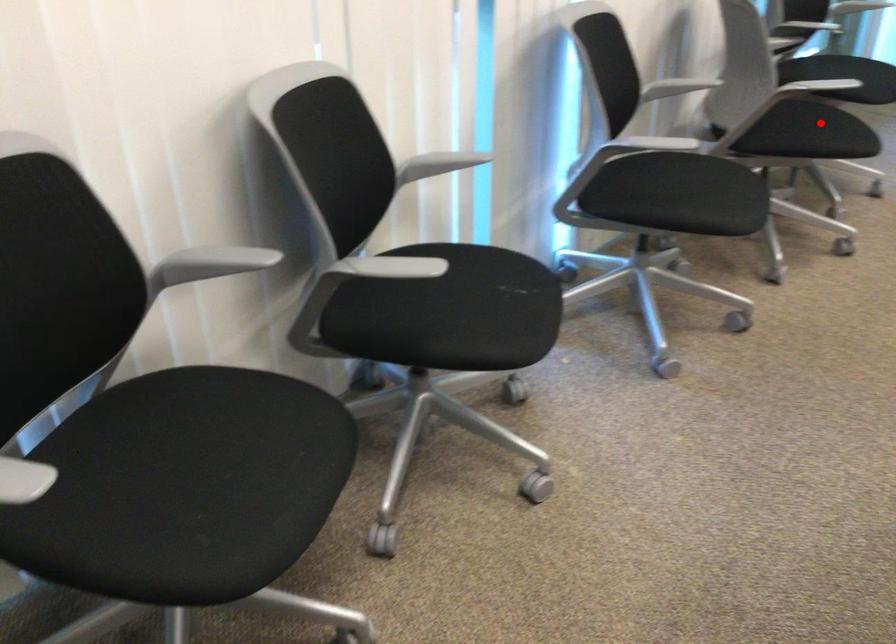
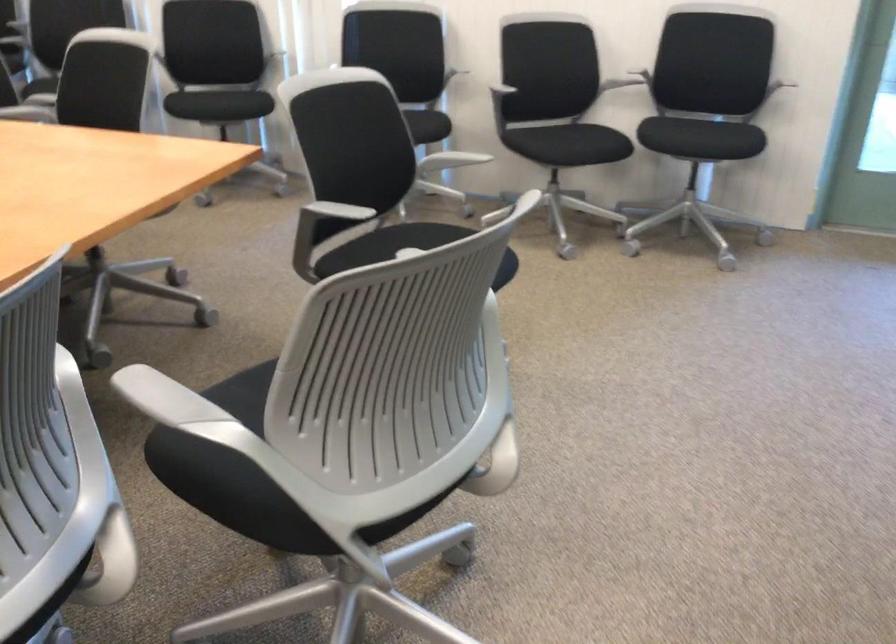
Question: I am providing you with two images of the same scene from different viewpoints. Given a red point in image1, look at the same physical point in image2. Is it:

Choices:
 (A) Closer to the viewpoint
 (B) Farther from the viewpoint

Answer: (B)